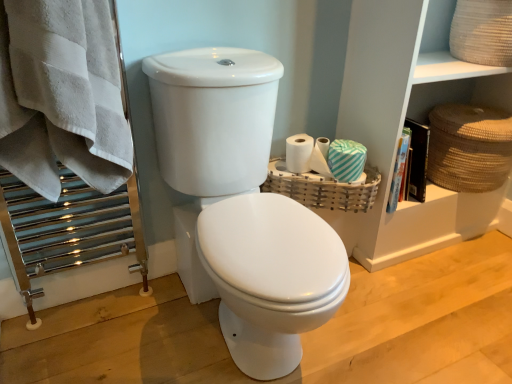
You are a GUI agent. You are given a task and a screenshot of the screen. Output one action in this format:
    pyautogui.click(x=<x>, y=<y>)
    Task: Click on the free area in between rattan basket at upper right, which ranks as the first shelf in bottom-to-top order, and white glossy toilet at center
    The width and height of the screenshot is (512, 384).
    Given the screenshot: What is the action you would take?
    pyautogui.click(x=403, y=293)